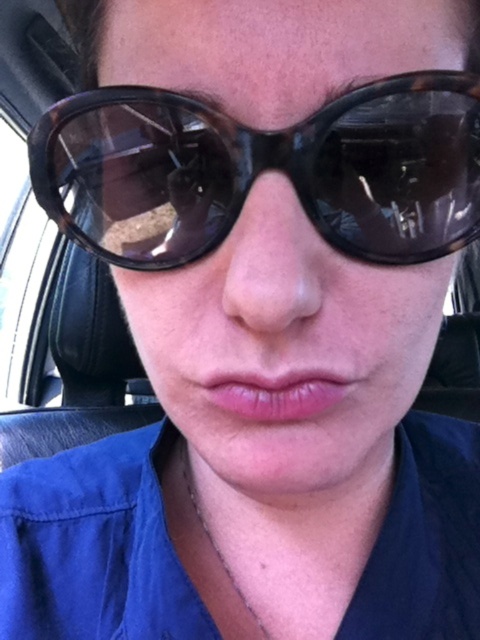
Which is above, tortoiseshell sunglasses at center or pink glossy lips at center?

tortoiseshell sunglasses at center

Does point (425, 250) come closer to viewer compared to point (224, 401)?

No, (425, 250) is further to viewer.

The height and width of the screenshot is (640, 480). I want to click on tortoiseshell sunglasses at center, so click(x=264, y=170).